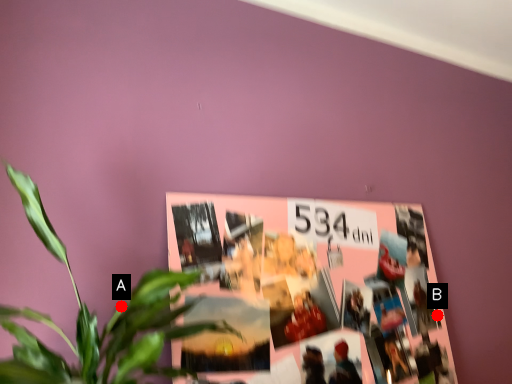
Question: Two points are circled on the image, labeled by A and B beside each circle. Which point is closer to the camera?

Choices:
 (A) A is closer
 (B) B is closer

Answer: (A)